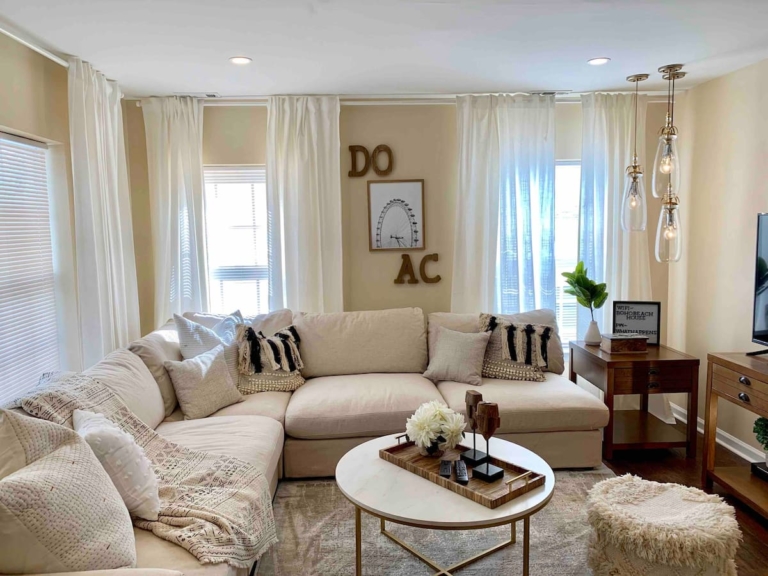
At what (x,y) coordinates should I click in order to perform the action: click on light. Please return your answer as a coordinate pair (x, y). The height and width of the screenshot is (576, 768). Looking at the image, I should click on (240, 64), (601, 60), (640, 211), (670, 160), (674, 233).